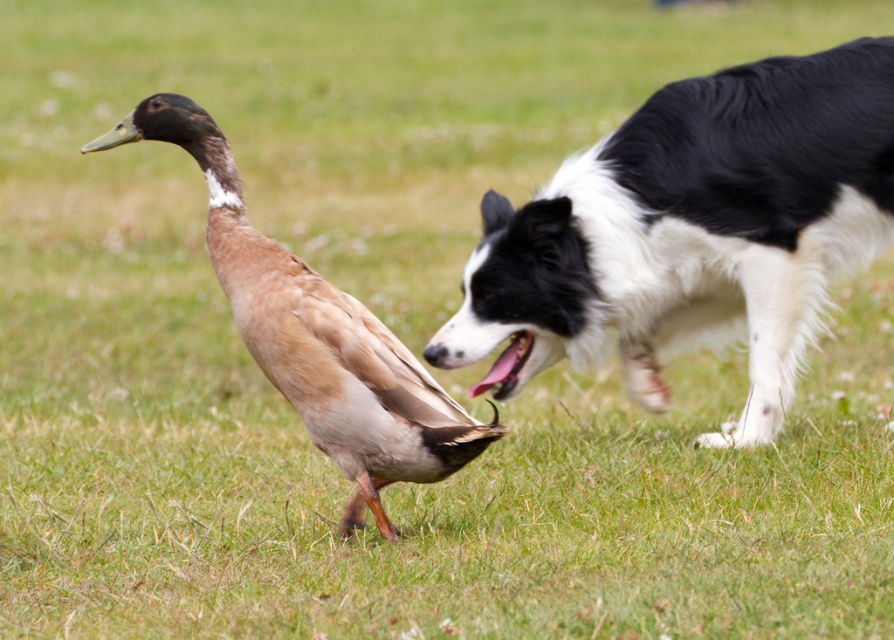
Question: Can you confirm if black and white fur dog at right is positioned to the right of brown feathered duck at center?

Choices:
 (A) yes
 (B) no

Answer: (A)

Question: Which point is farther to the camera?

Choices:
 (A) black and white fur dog at right
 (B) brown feathered duck at center

Answer: (A)

Question: Which point appears closest to the camera in this image?

Choices:
 (A) (325, 426)
 (B) (890, 118)

Answer: (A)

Question: Is black and white fur dog at right wider than brown feathered duck at center?

Choices:
 (A) no
 (B) yes

Answer: (B)

Question: Does black and white fur dog at right appear over brown feathered duck at center?

Choices:
 (A) yes
 (B) no

Answer: (A)